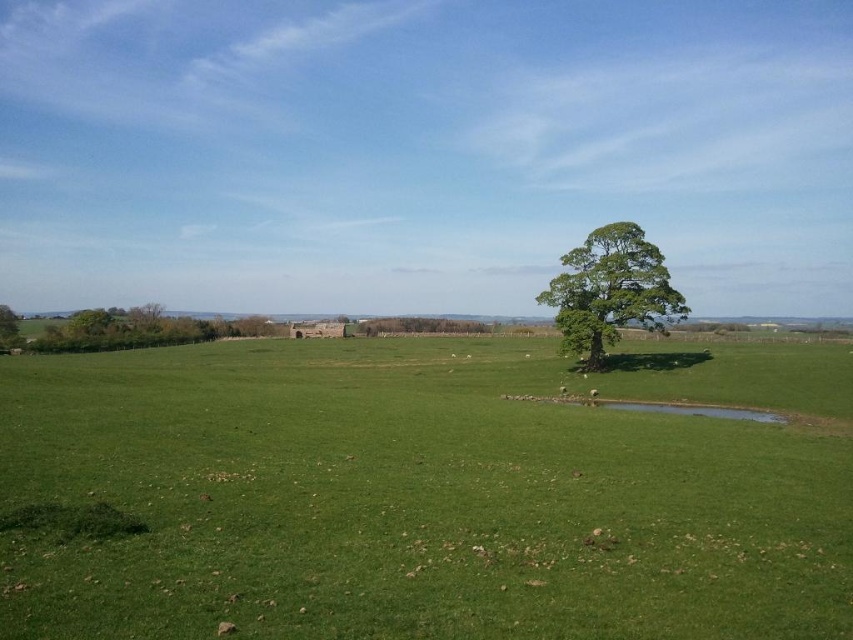
Question: Which object is positioned closest to the green grassy field at center?

Choices:
 (A) green leafy tree at left
 (B) green leafy tree at center

Answer: (B)

Question: Among these points, which one is nearest to the camera?

Choices:
 (A) (573, 348)
 (B) (12, 321)
 (C) (166, 404)

Answer: (C)

Question: Does green leafy tree at center have a larger size compared to green leafy tree at left?

Choices:
 (A) yes
 (B) no

Answer: (B)

Question: Does green leafy tree at center have a smaller size compared to green leafy tree at left?

Choices:
 (A) no
 (B) yes

Answer: (B)

Question: Does green grassy field at center have a larger size compared to green leafy tree at center?

Choices:
 (A) no
 (B) yes

Answer: (B)

Question: Estimate the real-world distances between objects in this image. Which object is closer to the green leafy tree at center?

Choices:
 (A) green leafy tree at left
 (B) green grassy field at center

Answer: (B)